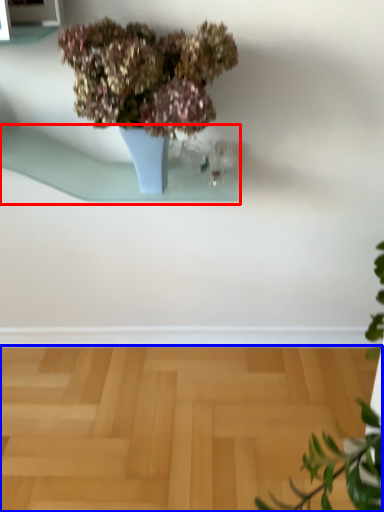
Question: Which object appears farthest to the camera in this image, window sill (highlighted by a red box) or surface (highlighted by a blue box)?

Choices:
 (A) window sill
 (B) surface

Answer: (B)